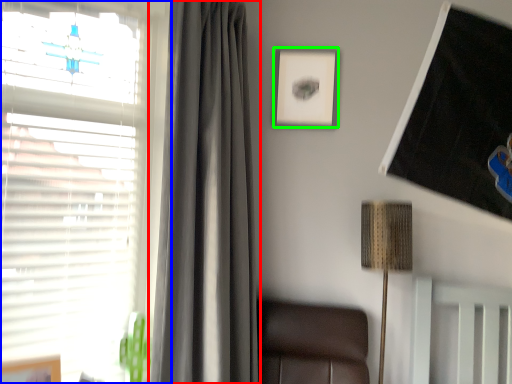
Question: Which object is positioned farthest from curtain (highlighted by a red box)? Select from window (highlighted by a blue box) and picture frame (highlighted by a green box).

Choices:
 (A) window
 (B) picture frame

Answer: (B)